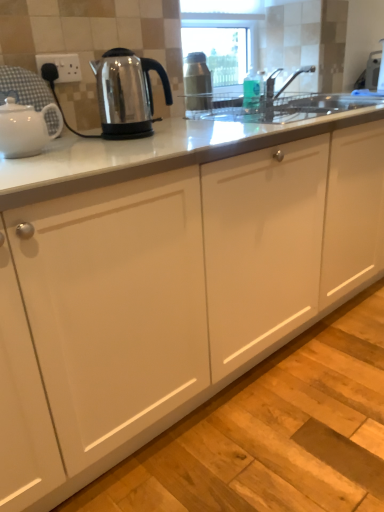
Question: Considering their positions, is white glossy teapot at left, marked as the 2th kettle in a right-to-left arrangement, located in front of or behind stainless steel kettle at left, the second kettle viewed from the left?

Choices:
 (A) behind
 (B) front

Answer: (B)

Question: From the image's perspective, relative to stainless steel kettle at left, positioned as the 1th kettle in right-to-left order, is white glossy teapot at left, placed as the first kettle when sorted from left to right, above or below?

Choices:
 (A) above
 (B) below

Answer: (B)

Question: Considering the real-world distances, which object is closest to the white glossy teapot at left, marked as the 2th kettle in a right-to-left arrangement?

Choices:
 (A) white plastic socket at upper left
 (B) stainless steel kettle at left, the second kettle viewed from the left

Answer: (B)

Question: Estimate the real-world distances between objects in this image. Which object is closer to the white glossy teapot at left, placed as the first kettle when sorted from left to right?

Choices:
 (A) white plastic socket at upper left
 (B) stainless steel kettle at left, the second kettle viewed from the left

Answer: (B)